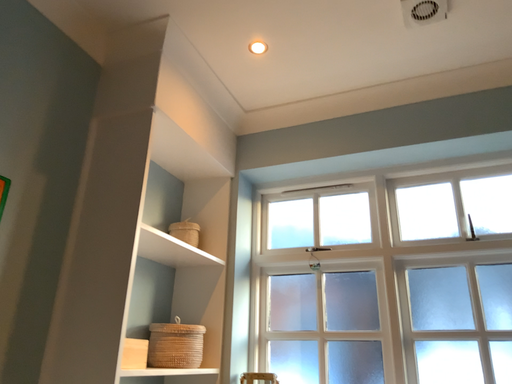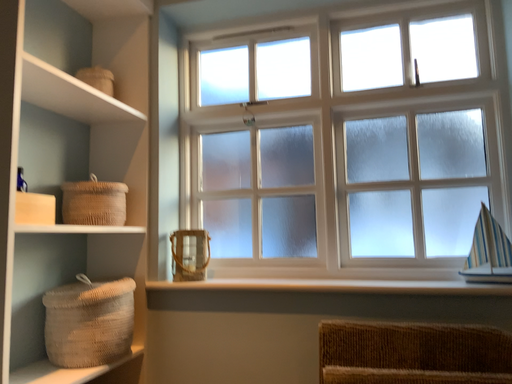
Question: How did the camera likely rotate when shooting the video?

Choices:
 (A) rotated downward
 (B) rotated upward

Answer: (A)